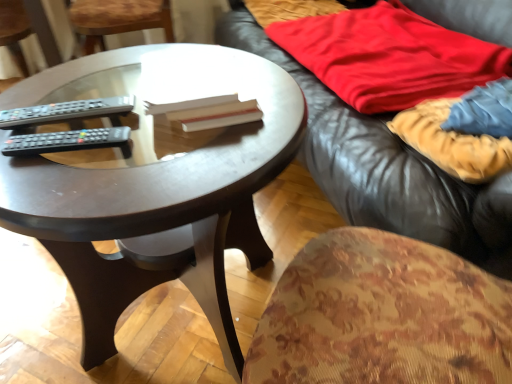
Locate an element on the screen. Image resolution: width=512 pixels, height=384 pixels. unoccupied space behind black plastic remote control at left, which is the 1th remote control in front-to-back order is located at coordinates (76, 91).